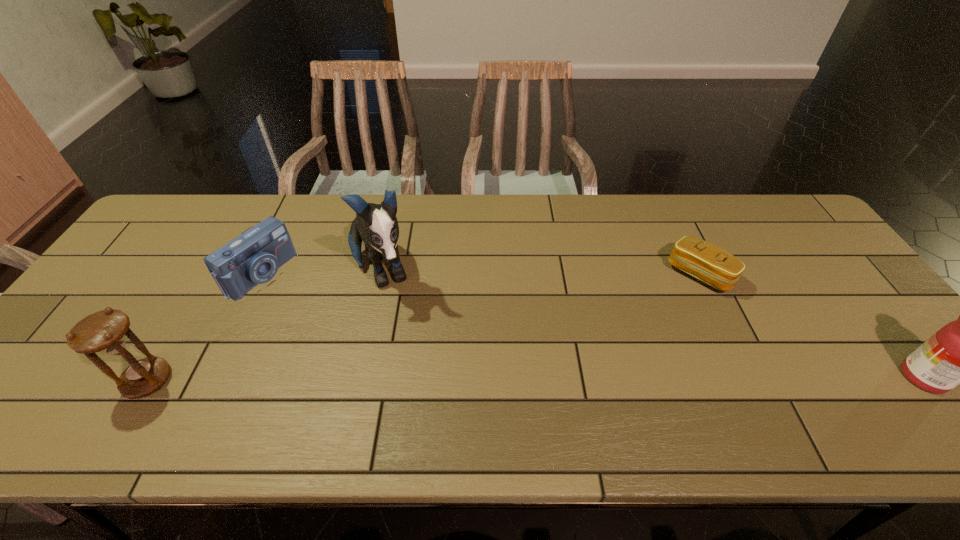
Identify the location of object that is at the far edge. The height and width of the screenshot is (540, 960). (376, 224).

Identify the location of hourglass present at the near edge. The height and width of the screenshot is (540, 960). (105, 332).

Identify the location of fruit juice that is at the near edge. (959, 353).

This screenshot has width=960, height=540. Find the location of `object at the right edge`. object at the right edge is located at coordinates (959, 353).

You are a GUI agent. You are given a task and a screenshot of the screen. Output one action in this format:
    pyautogui.click(x=<x>, y=<y>)
    Task: Click on the object situated at the near right corner
    The height and width of the screenshot is (540, 960).
    Given the screenshot: What is the action you would take?
    pyautogui.click(x=959, y=353)

Find the location of a particular element. vacant space at the far edge of the desktop is located at coordinates (516, 208).

At what (x,y) coordinates should I click in order to perform the action: click on free space at the near edge. Please return your answer as a coordinate pair (x, y). Looking at the image, I should click on (845, 402).

The image size is (960, 540). I want to click on free space at the left edge of the desktop, so click(x=168, y=247).

The width and height of the screenshot is (960, 540). What are the coordinates of `vacant region at the right edge of the desktop` in the screenshot? It's located at (852, 343).

Identify the location of vacant region at the far right corner of the desktop. The width and height of the screenshot is (960, 540). (764, 237).